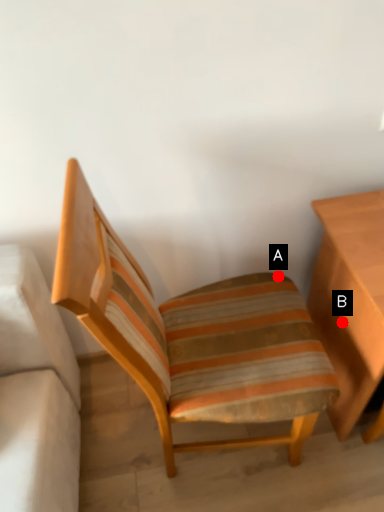
Question: Two points are circled on the image, labeled by A and B beside each circle. Which point is farther from the camera taking this photo?

Choices:
 (A) A is further
 (B) B is further

Answer: (A)